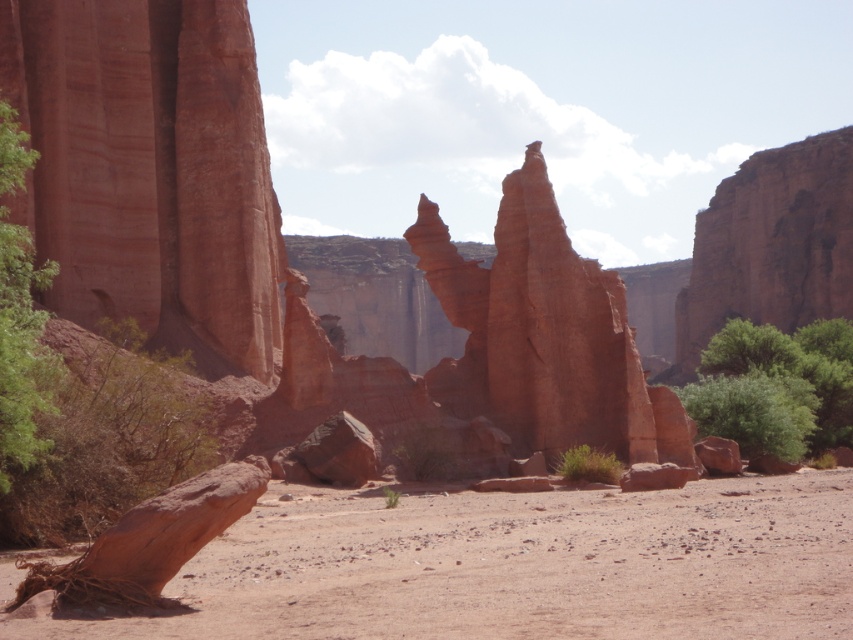
Is smooth sandstone rock formation at center thinner than green leafy bush at lower left?

Incorrect, smooth sandstone rock formation at center's width is not less than green leafy bush at lower left's.

The width and height of the screenshot is (853, 640). Find the location of `smooth sandstone rock formation at center`. smooth sandstone rock formation at center is located at coordinates (543, 333).

I want to click on smooth sandstone rock formation at center, so tap(543, 333).

Can you confirm if green leafy tree at lower right is shorter than green leafy bush at left?

Yes.

Looking at this image, is green leafy tree at lower right to the left of green leafy bush at left from the viewer's perspective?

No, green leafy tree at lower right is not to the left of green leafy bush at left.

Between point (759, 385) and point (16, 180), which one is positioned behind?

Point (759, 385)

Where is `green leafy tree at lower right`? This screenshot has height=640, width=853. green leafy tree at lower right is located at coordinates (775, 387).

Can you confirm if green leafy bush at lower left is positioned to the right of green leafy bush at left?

Correct, you'll find green leafy bush at lower left to the right of green leafy bush at left.

Looking at this image, is green leafy bush at lower left taller than green leafy bush at left?

No, green leafy bush at lower left is not taller than green leafy bush at left.

Is point (76, 532) closer to camera compared to point (26, 445)?

No, it is not.

Where is `green leafy bush at lower left`? Image resolution: width=853 pixels, height=640 pixels. green leafy bush at lower left is located at coordinates (105, 436).